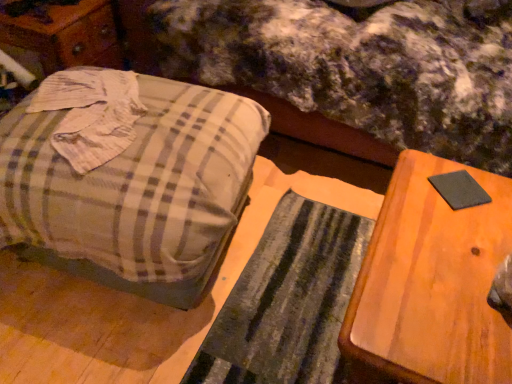
This screenshot has width=512, height=384. I want to click on spots to the right of plaid fabric suitcase at left, so click(305, 246).